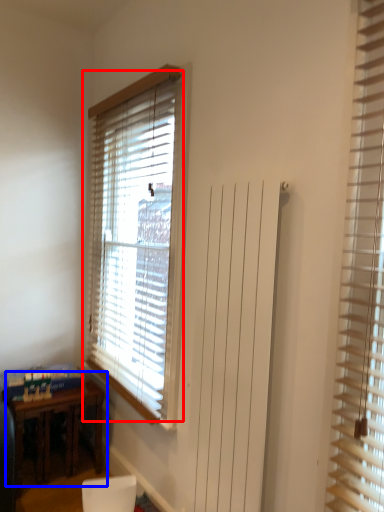
Question: Which point is further to the camera, window blind (highlighted by a red box) or table (highlighted by a blue box)?

Choices:
 (A) window blind
 (B) table

Answer: (B)